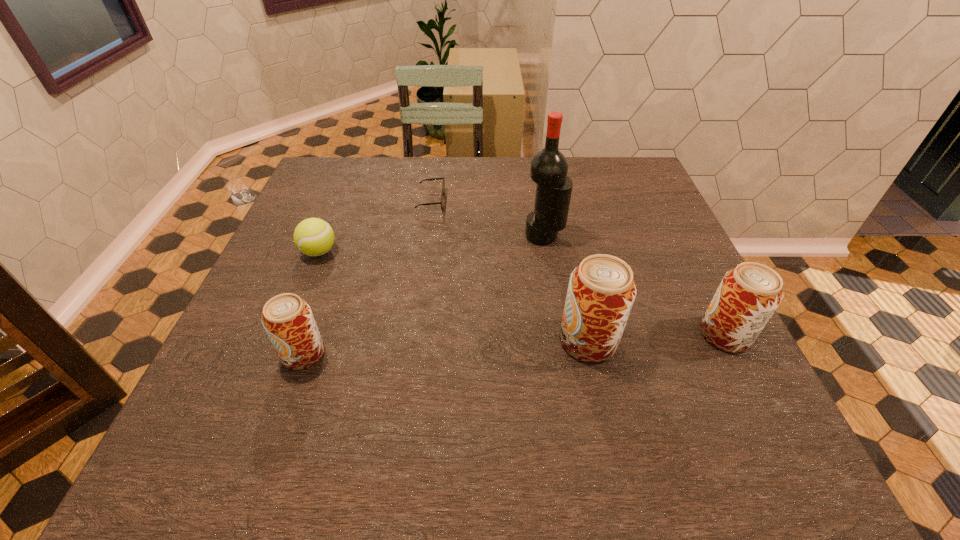
You are a GUI agent. You are given a task and a screenshot of the screen. Output one action in this format:
    pyautogui.click(x=<x>, y=<y>)
    Task: Click on the blank space located 0.230m on the back of the second beer can from right to left
    This screenshot has height=540, width=960.
    Given the screenshot: What is the action you would take?
    pyautogui.click(x=567, y=248)

The height and width of the screenshot is (540, 960). Identify the location of vacant point located 0.340m on the left of the fourth shortest object. (535, 335).

At what (x,y) coordinates should I click in order to perform the action: click on vacant space located on the front of the tallest object. Please return your answer as a coordinate pair (x, y). The width and height of the screenshot is (960, 540). Looking at the image, I should click on (556, 302).

Find the location of a particular element. This screenshot has height=540, width=960. free spot located 0.330m on the front of the fifth tallest object is located at coordinates (266, 383).

You are a GUI agent. You are given a task and a screenshot of the screen. Output one action in this format:
    pyautogui.click(x=<x>, y=<y>)
    Task: Click on the free space located 0.100m on the front-facing side of the sunglasses
    The image size is (960, 540).
    Given the screenshot: What is the action you would take?
    pyautogui.click(x=479, y=201)

Find the location of a particular element. The height and width of the screenshot is (540, 960). object that is at the far edge is located at coordinates (443, 185).

I want to click on object located at the near edge, so click(287, 319).

The image size is (960, 540). Identify the location of beer can that is at the left edge. (287, 319).

This screenshot has width=960, height=540. I want to click on tennis ball that is at the left edge, so click(313, 236).

Locate an element on the screen. The width and height of the screenshot is (960, 540). object situated at the right edge is located at coordinates (748, 295).